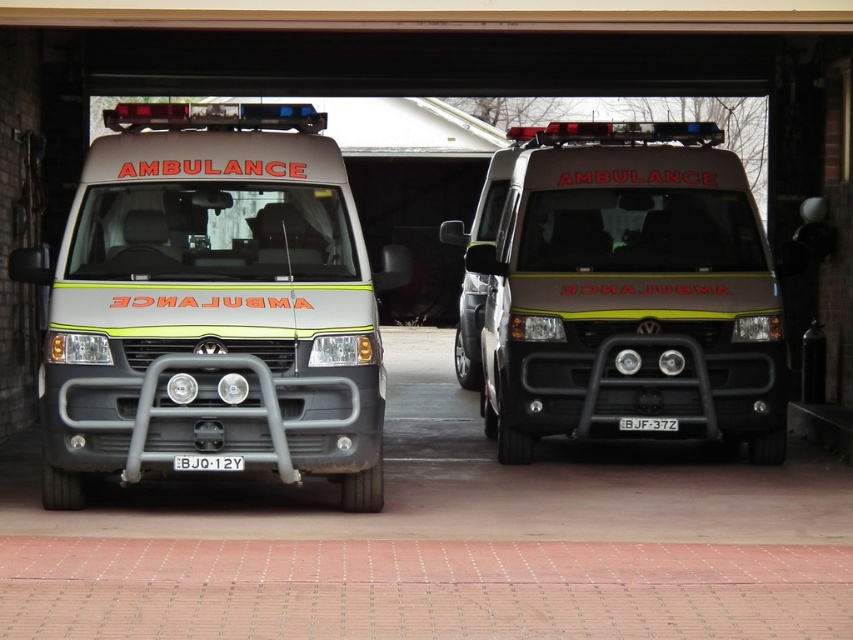
Does matte grey ambulance at center have a lesser width compared to matte silver ambulance at center?

No.

What do you see at coordinates (212, 305) in the screenshot?
I see `matte grey ambulance at center` at bounding box center [212, 305].

Describe the element at coordinates (212, 305) in the screenshot. The width and height of the screenshot is (853, 640). I see `matte grey ambulance at center` at that location.

Where is `matte grey ambulance at center`? The width and height of the screenshot is (853, 640). matte grey ambulance at center is located at coordinates (212, 305).